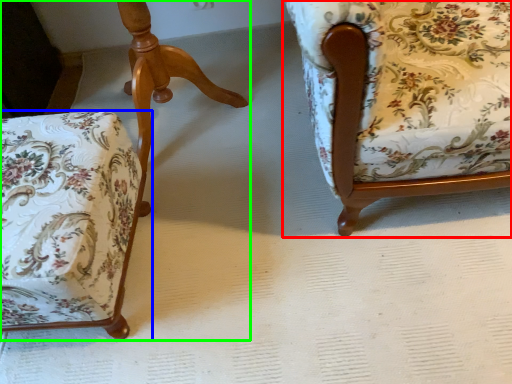
Question: Which object is positioned farthest from chair (highlighted by a red box)? Select from chair (highlighted by a blue box) and chair (highlighted by a green box).

Choices:
 (A) chair
 (B) chair

Answer: (B)